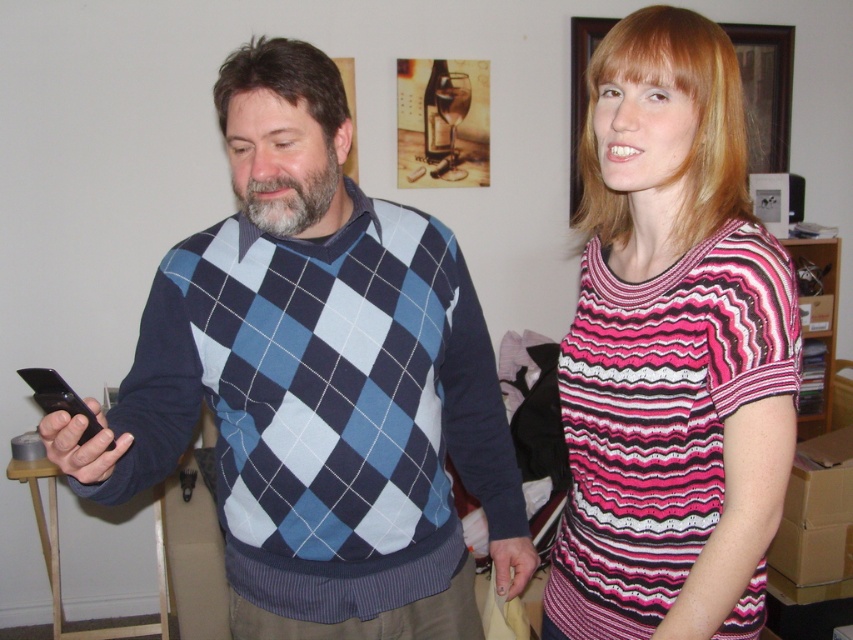
Question: Among these objects, which one is farthest from the camera?

Choices:
 (A) pink striped sweater at right
 (B) blue argyle sweater at center

Answer: (A)

Question: Which object is farther from the camera taking this photo?

Choices:
 (A) pink striped sweater at right
 (B) black matte smartphone at left
 (C) blue argyle sweater at center

Answer: (A)

Question: Does blue argyle sweater at center appear over black matte smartphone at left?

Choices:
 (A) yes
 (B) no

Answer: (B)

Question: Does blue argyle sweater at center appear on the left side of pink striped sweater at right?

Choices:
 (A) no
 (B) yes

Answer: (B)

Question: Is pink striped sweater at right to the right of black matte smartphone at left from the viewer's perspective?

Choices:
 (A) yes
 (B) no

Answer: (A)

Question: Which point is closer to the camera?

Choices:
 (A) (595, 440)
 (B) (485, 512)

Answer: (A)